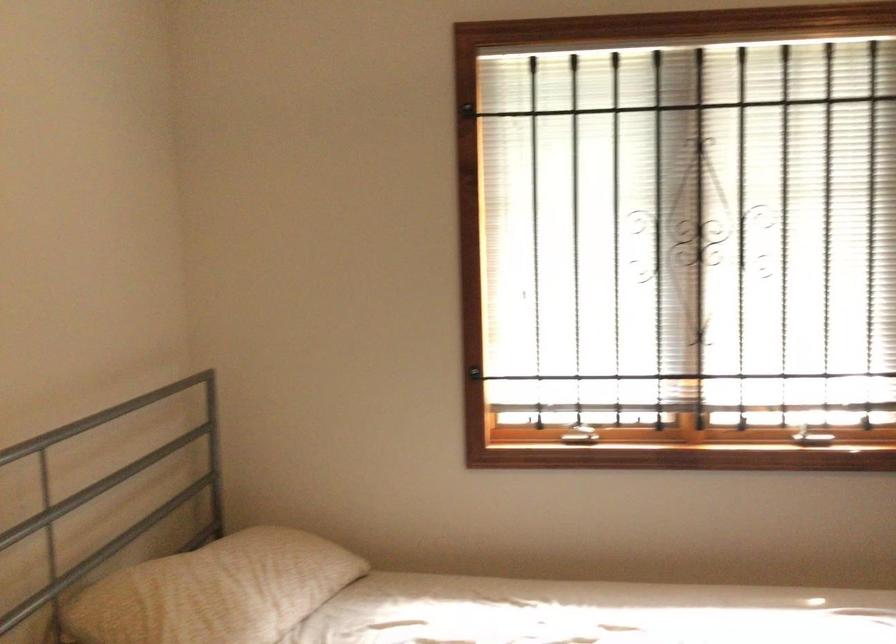
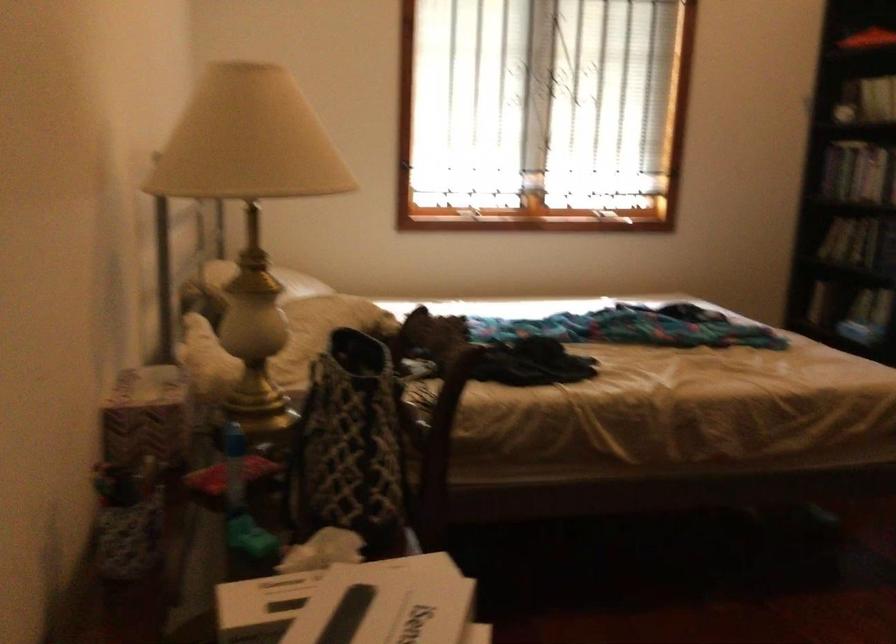
The images are taken continuously from a first-person perspective. In which direction are you moving?

The cameraman moved toward left, backward.